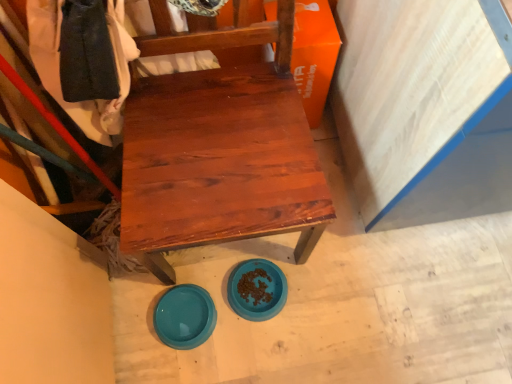
Question: Is orange matte cardboard box at upper right wider than teal glossy plate at lower center, which is the second plate in right-to-left order?

Choices:
 (A) no
 (B) yes

Answer: (B)

Question: Could you tell me if orange matte cardboard box at upper right is turned towards teal glossy plate at lower center, which is the second plate in right-to-left order?

Choices:
 (A) no
 (B) yes

Answer: (A)

Question: Is orange matte cardboard box at upper right beside teal glossy plate at lower center, arranged as the 1th plate when viewed from the left?

Choices:
 (A) yes
 (B) no

Answer: (B)

Question: Is orange matte cardboard box at upper right thinner than teal glossy plate at lower center, arranged as the 1th plate when viewed from the left?

Choices:
 (A) yes
 (B) no

Answer: (B)

Question: Is orange matte cardboard box at upper right looking in the opposite direction of teal glossy plate at lower center, which is the second plate in right-to-left order?

Choices:
 (A) yes
 (B) no

Answer: (B)

Question: Would you say orange matte cardboard box at upper right is to the left or to the right of matte wood chair at center in the picture?

Choices:
 (A) right
 (B) left

Answer: (A)

Question: Considering their positions, is orange matte cardboard box at upper right located in front of or behind matte wood chair at center?

Choices:
 (A) front
 (B) behind

Answer: (B)

Question: In terms of width, does orange matte cardboard box at upper right look wider or thinner when compared to matte wood chair at center?

Choices:
 (A) thin
 (B) wide

Answer: (A)

Question: From a real-world perspective, is orange matte cardboard box at upper right above or below matte wood chair at center?

Choices:
 (A) above
 (B) below

Answer: (B)

Question: In terms of size, does blue plastic bowl at lower center, the 1th plate positioned from the right, appear bigger or smaller than matte wood chair at center?

Choices:
 (A) big
 (B) small

Answer: (B)

Question: Is blue plastic bowl at lower center, marked as the 2th plate in a left-to-right arrangement, situated inside matte wood chair at center or outside?

Choices:
 (A) inside
 (B) outside

Answer: (A)

Question: In terms of height, does blue plastic bowl at lower center, marked as the 2th plate in a left-to-right arrangement, look taller or shorter compared to matte wood chair at center?

Choices:
 (A) tall
 (B) short

Answer: (B)

Question: Is point tap(265, 273) positioned closer to the camera than point tap(156, 21)?

Choices:
 (A) farther
 (B) closer

Answer: (A)

Question: Is orange matte cardboard box at upper right in front of or behind teal glossy plate at lower center, which is the second plate in right-to-left order, in the image?

Choices:
 (A) front
 (B) behind

Answer: (A)

Question: Considering the positions of orange matte cardboard box at upper right and teal glossy plate at lower center, arranged as the 1th plate when viewed from the left, in the image, is orange matte cardboard box at upper right taller or shorter than teal glossy plate at lower center, arranged as the 1th plate when viewed from the left,?

Choices:
 (A) tall
 (B) short

Answer: (A)